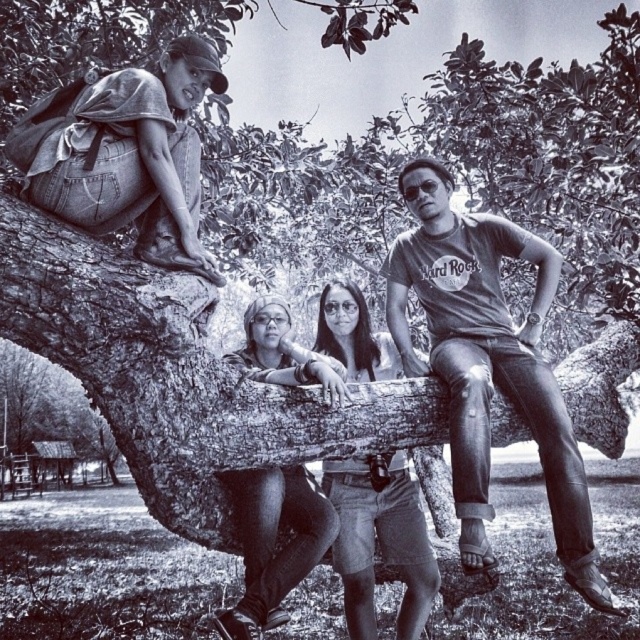
Is hard rock t-shirt at center taller than matte black pants at center?

Yes.

Which is below, hard rock t-shirt at center or matte black pants at center?

matte black pants at center is below.

Is point (582, 506) farther from camera compared to point (275, 304)?

No, (582, 506) is in front of (275, 304).

This screenshot has height=640, width=640. I want to click on hard rock t-shirt at center, so click(488, 364).

Does point (353, 634) come in front of point (237, 474)?

No.

Does denim shorts at center have a greater height compared to matte black pants at center?

Indeed, denim shorts at center has a greater height compared to matte black pants at center.

The image size is (640, 640). I want to click on denim shorts at center, so click(380, 540).

Identify the location of hard rock t-shirt at center. tap(488, 364).

Is point (600, 582) positioned behind point (348, 627)?

No, it is in front of (348, 627).

Between point (388, 260) and point (364, 506), which one is positioned in front?

Point (388, 260) is more forward.

Image resolution: width=640 pixels, height=640 pixels. I want to click on hard rock t-shirt at center, so click(x=488, y=364).